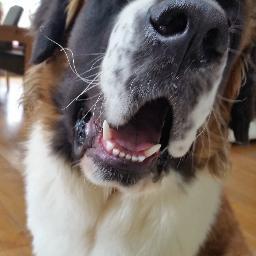
The height and width of the screenshot is (256, 256). I want to click on white fur, so click(167, 220), click(88, 176), click(47, 162).